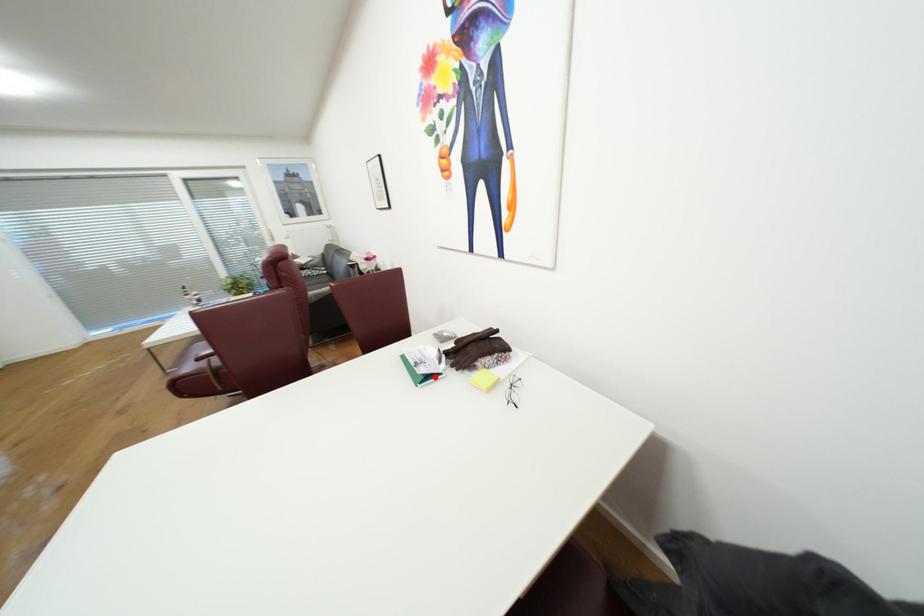
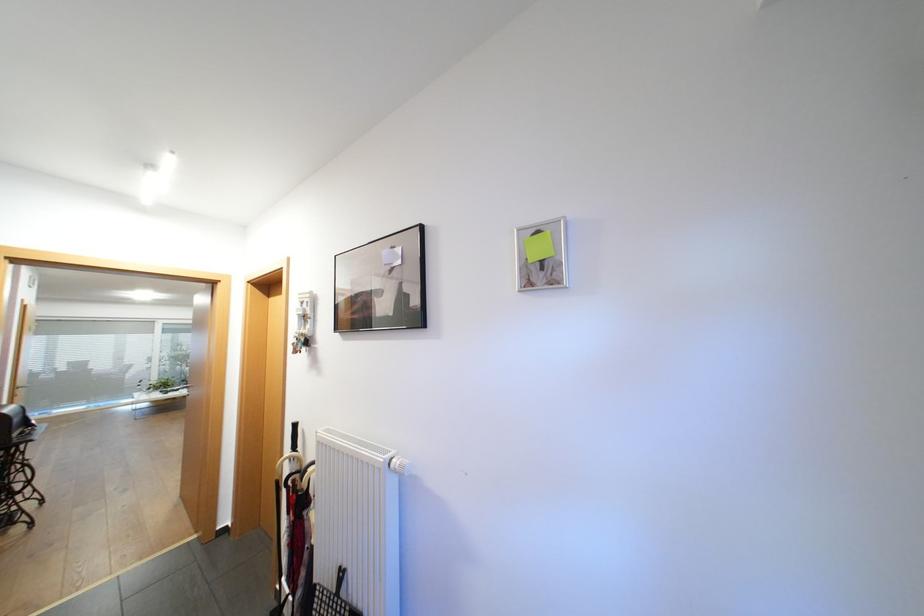
Question: I am providing you with two images of the same scene from different viewpoints. A red point is marked on the first image. Is the red point's position out of view in image 2?

Choices:
 (A) Yes
 (B) No

Answer: (A)